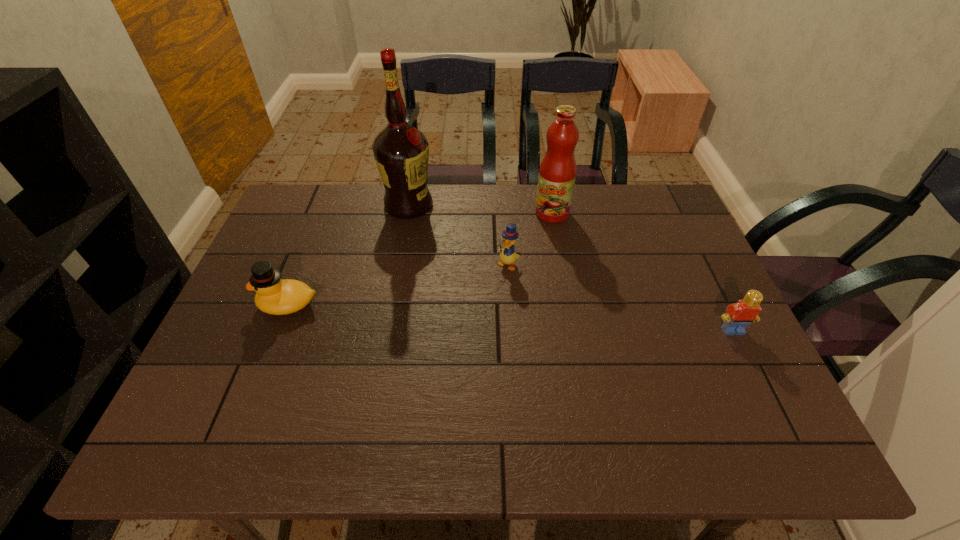
Find the location of a particular element. This screenshot has width=960, height=540. vacant space on the desktop that is between the second nearest object and the Lego and is positioned on the label of the alcohol is located at coordinates (x=486, y=316).

Identify the location of vacant space on the desktop that is between the fourth farthest object and the nearest object and is positioned on the front label of the second object from right to left. (489, 316).

In order to click on free space on the desktop that is between the fourth farthest object and the nearest object and is positioned on the face of the third object from right to left, where the monocle is placed in this screenshot , I will do `click(466, 315)`.